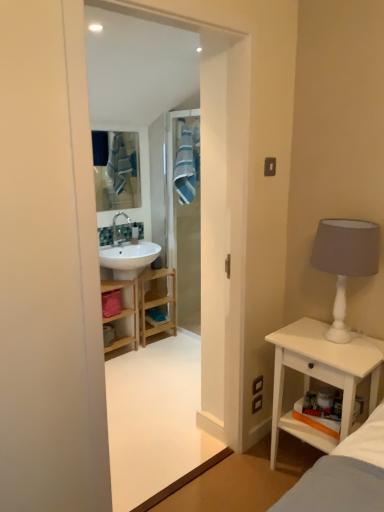
Where is `free area below white matte table lamp at right (from a real-world perspective)`? Image resolution: width=384 pixels, height=512 pixels. free area below white matte table lamp at right (from a real-world perspective) is located at coordinates 335,342.